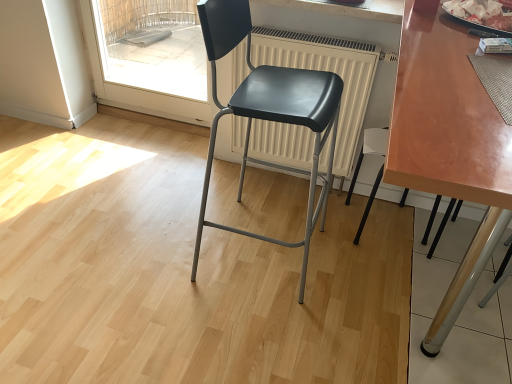
Find the location of a particular element. Image resolution: width=512 pixels, height=384 pixels. vacant area that lies between shiny brown table at center and matte black chair at center, the second chair when ordered from right to left is located at coordinates (285, 284).